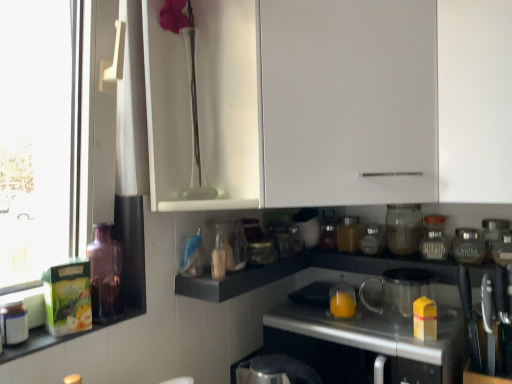
At what (x,y) coordinates should I click in order to perform the action: click on free space in front of translucent glass blender at lower center, the fourth appliance viewed from the right. Please return your answer as a coordinate pair (x, y). The width and height of the screenshot is (512, 384). Looking at the image, I should click on (408, 339).